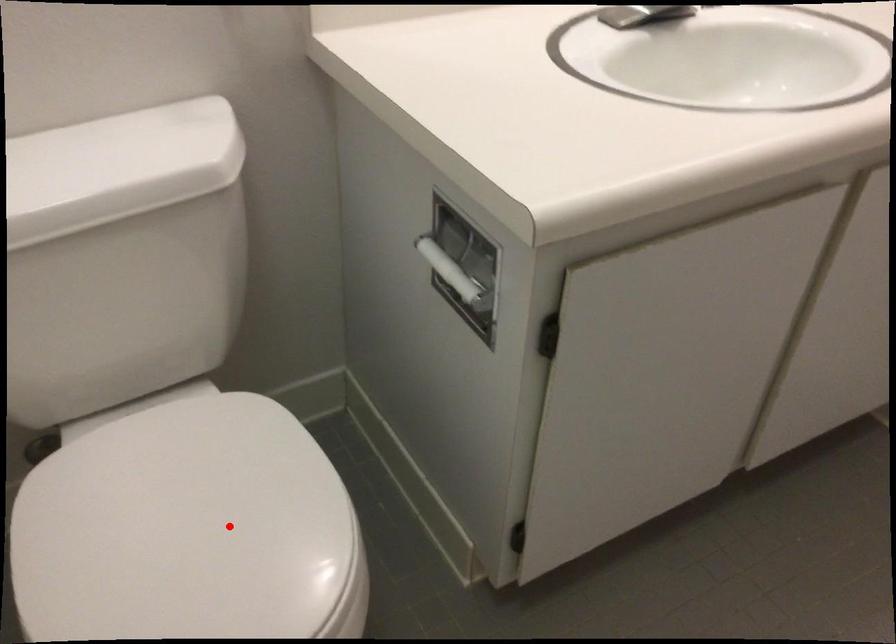
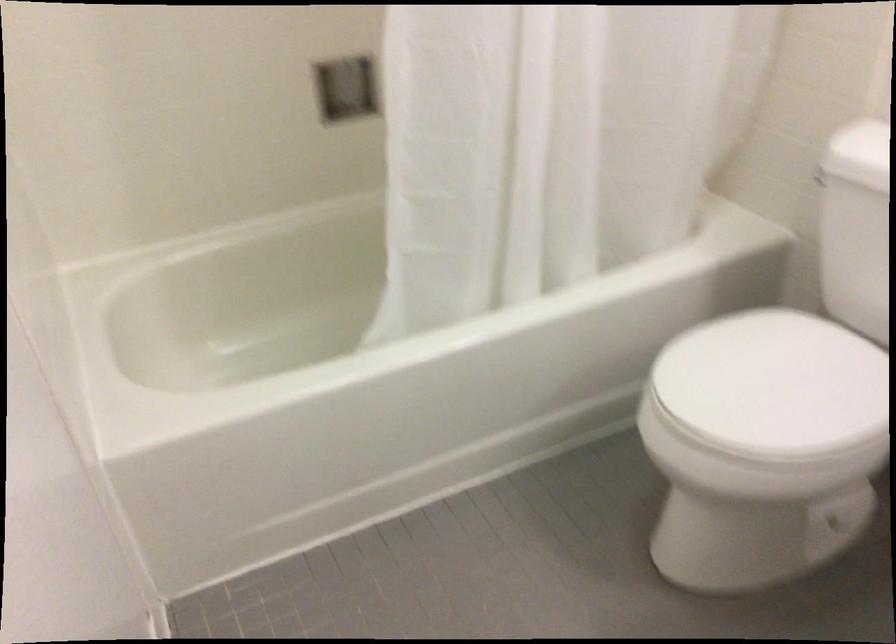
Where in the second image is the point corresponding to the highlighted location from the first image?

(773, 384)